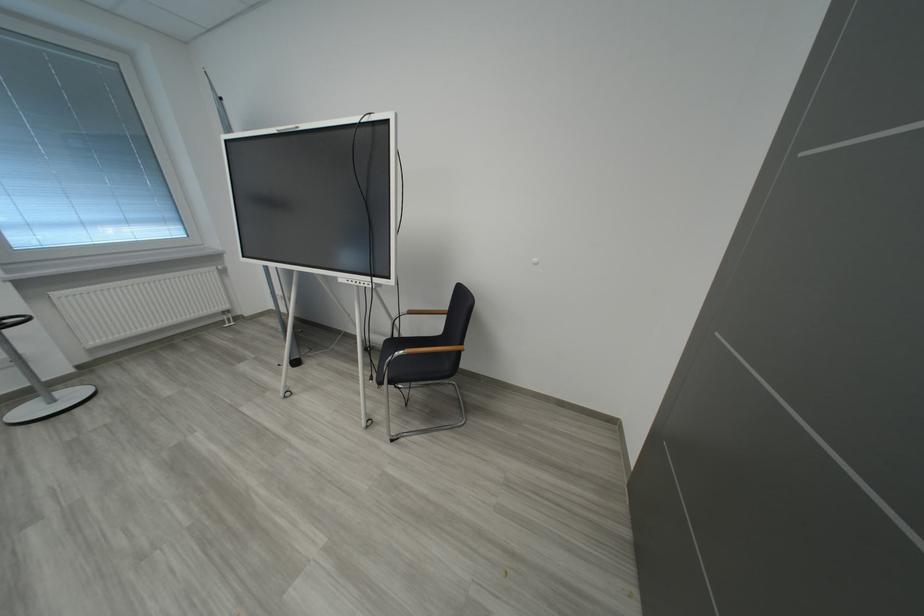
At what (x,y) coordinates should I click in order to perform the action: click on wooden chair armrest. Please return your answer as a coordinate pair (x, y). Looking at the image, I should click on (416, 312).